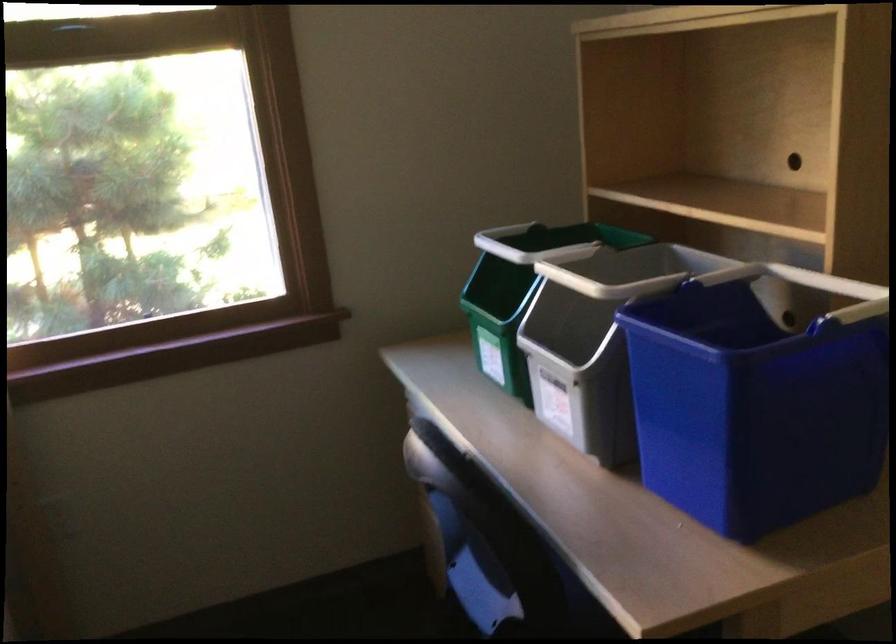
Describe the element at coordinates (794, 312) in the screenshot. I see `a blue bin handle` at that location.